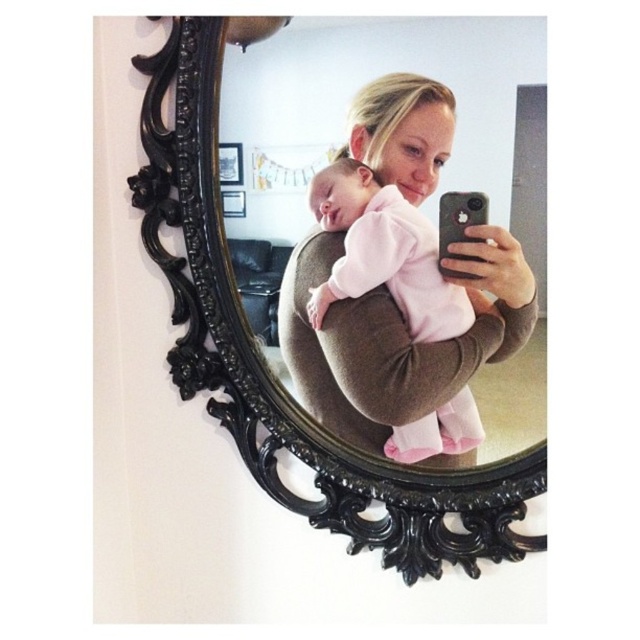
You are standing in front of the mirror and see two points in the reflection. The first point is at coordinates point (140, 182) and the second is at point (314, 204). Which point is closer to you?

Point (140, 182) is closer to you because it is further to the viewer than point (314, 204).

You are a photographer trying to capture a clear photo of the black ornate mirror at center and the pink soft fabric baby at center in the reflection. Since the mirror is reflective, you need to ensure both objects are visible. Based on their positions, which object might be more challenging to capture clearly in the reflection?

The pink soft fabric baby at center is behind the black ornate mirror at center, so it might be more challenging to capture clearly in the reflection because it is further away from the mirror surface.

You are a photographer trying to capture a selfie with a baby in a mirror. The mirror is at the center and the baby is also at the center. Which object, the black ornate mirror at center or the pink soft fabric baby at center, takes up more space in the reflection?

The black ornate mirror at center is bigger than the pink soft fabric baby at center, so the mirror takes up more space in the reflection.